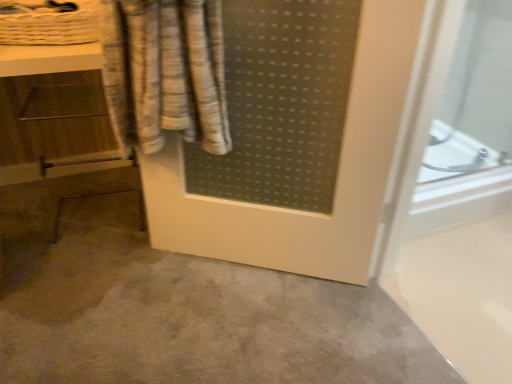
Question: Does gray matte concrete at center have a larger size compared to wooden vanity at left?

Choices:
 (A) yes
 (B) no

Answer: (B)

Question: Considering the relative sizes of gray matte concrete at center and wooden vanity at left in the image provided, is gray matte concrete at center taller than wooden vanity at left?

Choices:
 (A) yes
 (B) no

Answer: (B)

Question: Can we say gray matte concrete at center lies outside wooden vanity at left?

Choices:
 (A) no
 (B) yes

Answer: (B)

Question: From a real-world perspective, is gray matte concrete at center over wooden vanity at left?

Choices:
 (A) yes
 (B) no

Answer: (B)

Question: Does gray matte concrete at center appear on the right side of wooden vanity at left?

Choices:
 (A) yes
 (B) no

Answer: (A)

Question: Does gray matte concrete at center have a greater width compared to wooden vanity at left?

Choices:
 (A) no
 (B) yes

Answer: (B)

Question: Does wooden vanity at left have a lesser height compared to white woven basket at upper left?

Choices:
 (A) yes
 (B) no

Answer: (B)

Question: Does wooden vanity at left have a greater height compared to white woven basket at upper left?

Choices:
 (A) no
 (B) yes

Answer: (B)

Question: Is wooden vanity at left to the left of white woven basket at upper left from the viewer's perspective?

Choices:
 (A) no
 (B) yes

Answer: (B)

Question: Considering the relative sizes of wooden vanity at left and white woven basket at upper left in the image provided, is wooden vanity at left smaller than white woven basket at upper left?

Choices:
 (A) no
 (B) yes

Answer: (A)

Question: Is wooden vanity at left oriented away from white woven basket at upper left?

Choices:
 (A) no
 (B) yes

Answer: (A)

Question: Is wooden vanity at left further to the viewer compared to white woven basket at upper left?

Choices:
 (A) no
 (B) yes

Answer: (A)

Question: Can you confirm if gray matte concrete at center is bigger than white woven basket at upper left?

Choices:
 (A) no
 (B) yes

Answer: (B)